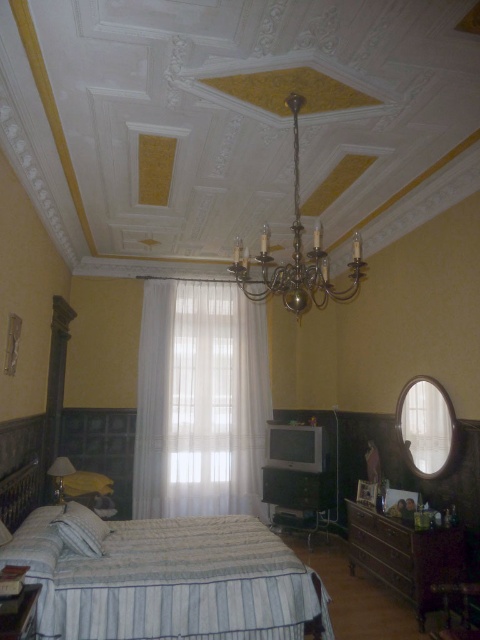
Question: Does sheer white curtain at center appear on the left side of wooden dresser at lower right?

Choices:
 (A) yes
 (B) no

Answer: (A)

Question: Which object is positioned farthest from the white striped bed at center?

Choices:
 (A) gold polished chandelier at upper center
 (B) sheer white curtain at center
 (C) wooden dresser at lower right

Answer: (B)

Question: Can you confirm if white striped bed at center is thinner than sheer white curtain at center?

Choices:
 (A) yes
 (B) no

Answer: (B)

Question: Considering the real-world distances, which object is closest to the sheer white curtain at center?

Choices:
 (A) gold polished chandelier at upper center
 (B) wooden dresser at lower right

Answer: (B)

Question: Which object is closer to the camera taking this photo?

Choices:
 (A) gold polished chandelier at upper center
 (B) sheer white curtain at center
 (C) white striped bed at center
 (D) wooden dresser at lower right

Answer: (A)

Question: Considering the relative positions of sheer white curtain at center and wooden dresser at lower right in the image provided, where is sheer white curtain at center located with respect to wooden dresser at lower right?

Choices:
 (A) left
 (B) right

Answer: (A)